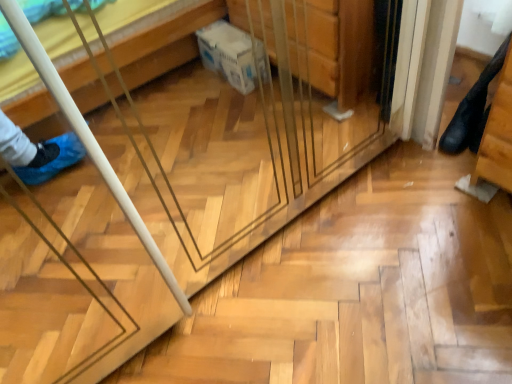
This screenshot has height=384, width=512. Find the location of `free space that is to the left of black leather drawer at right`. free space that is to the left of black leather drawer at right is located at coordinates (426, 166).